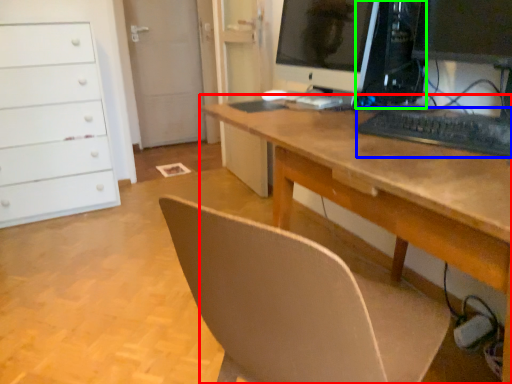
Question: Which object is positioned farthest from desk (highlighted by a red box)? Select from keyboard (highlighted by a blue box) and desktop computer (highlighted by a green box).

Choices:
 (A) keyboard
 (B) desktop computer

Answer: (B)